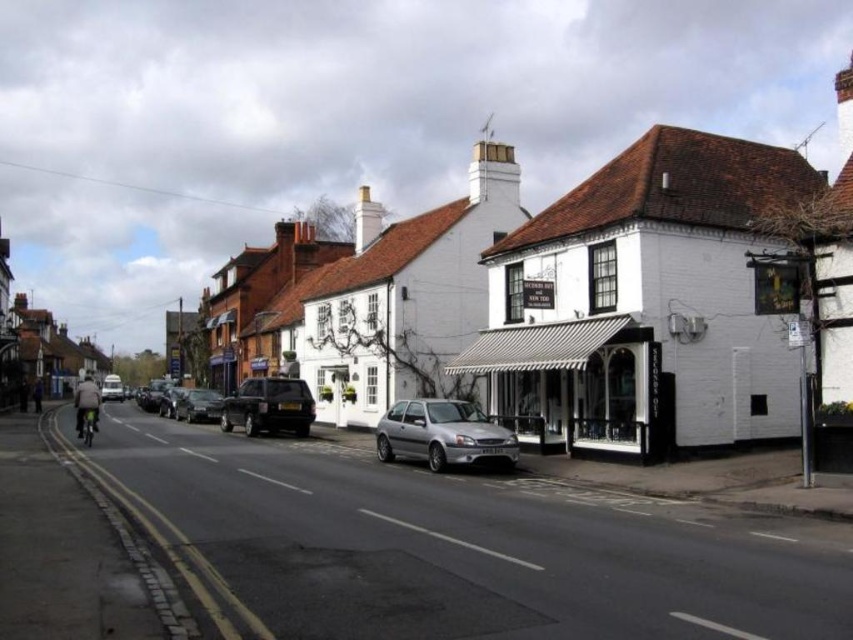
Does silver metallic hatchback at center have a lesser height compared to metallic silver car at center-left?

Indeed, silver metallic hatchback at center has a lesser height compared to metallic silver car at center-left.

Between point (491, 451) and point (167, 392), which one is positioned behind?

Point (167, 392)

Locate an element on the screen. silver metallic hatchback at center is located at coordinates (444, 435).

Consider the image. Is silver metallic car at center below silver metallic car at left?

Actually, silver metallic car at center is above silver metallic car at left.

Is point (201, 410) less distant than point (106, 392)?

Yes, it is in front of point (106, 392).

Who is more distant from viewer, (196, 397) or (119, 385)?

The point (119, 385) is more distant.

At what (x,y) coordinates should I click in order to perform the action: click on silver metallic car at center. Please return your answer as a coordinate pair (x, y). Looking at the image, I should click on (198, 404).

Does white striped awning at center come behind metallic silver car at center-left?

No, it is not.

Between white striped awning at center and metallic silver car at center-left, which one appears on the left side from the viewer's perspective?

From the viewer's perspective, metallic silver car at center-left appears more on the left side.

The width and height of the screenshot is (853, 640). What do you see at coordinates (572, 381) in the screenshot?
I see `white striped awning at center` at bounding box center [572, 381].

Identify the location of white striped awning at center. This screenshot has height=640, width=853. (x=572, y=381).